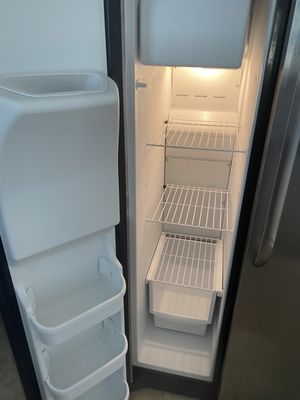
The image size is (300, 400). In order to click on floor in this screenshot , I will do `click(11, 378)`, `click(150, 395)`.